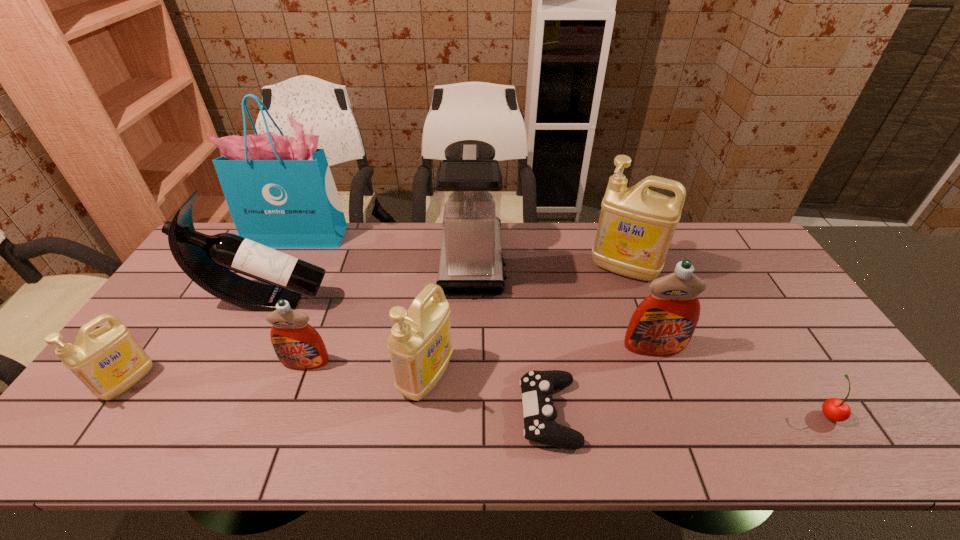
In order to click on vacant space located on the stand of the black wine bottle in this screenshot , I will do `click(359, 300)`.

This screenshot has width=960, height=540. In order to click on vacant space situated 0.080m on the front of the second biggest beige detergent in this screenshot , I will do `click(420, 439)`.

Where is `vacant region located 0.180m on the front surface of the bigger red detergent`? vacant region located 0.180m on the front surface of the bigger red detergent is located at coordinates (681, 420).

Identify the location of vacant space located 0.060m on the back of the leftmost beige detergent. This screenshot has height=540, width=960. (156, 343).

Locate an element on the screen. The height and width of the screenshot is (540, 960). vacant space located 0.070m on the front surface of the second detergent from left to right is located at coordinates (294, 395).

This screenshot has width=960, height=540. Find the location of `free spot located 0.200m on the left of the ninth tallest object`. free spot located 0.200m on the left of the ninth tallest object is located at coordinates (732, 414).

Where is `vacant space situated 0.070m on the surface of the shortest object`? The height and width of the screenshot is (540, 960). vacant space situated 0.070m on the surface of the shortest object is located at coordinates (492, 413).

I want to click on vacant space located 0.400m on the surface of the shortest object, so click(352, 413).

Where is `free spot located on the surface of the shortest object`? The height and width of the screenshot is (540, 960). free spot located on the surface of the shortest object is located at coordinates (453, 413).

The height and width of the screenshot is (540, 960). What are the coordinates of `shopping bag that is at the far edge` in the screenshot? It's located at (280, 191).